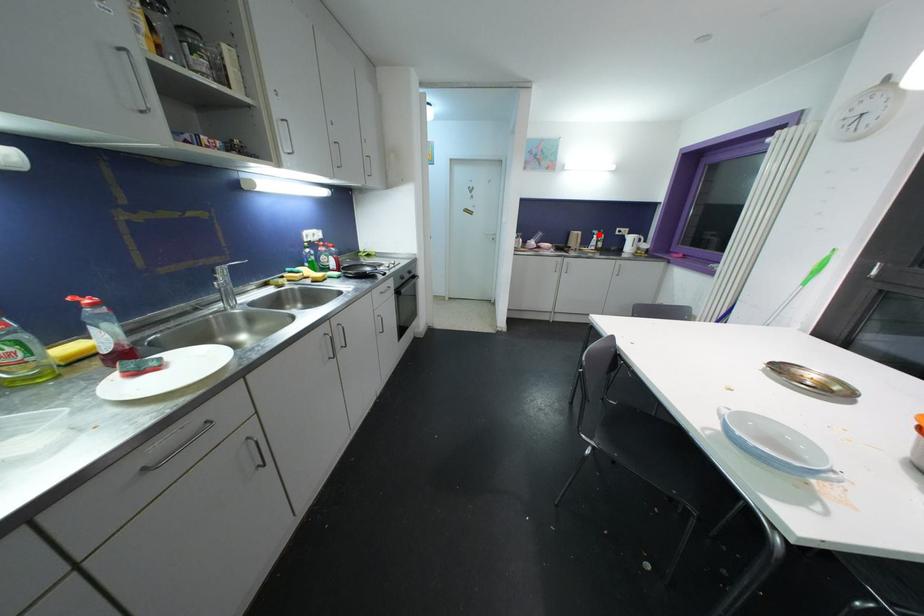
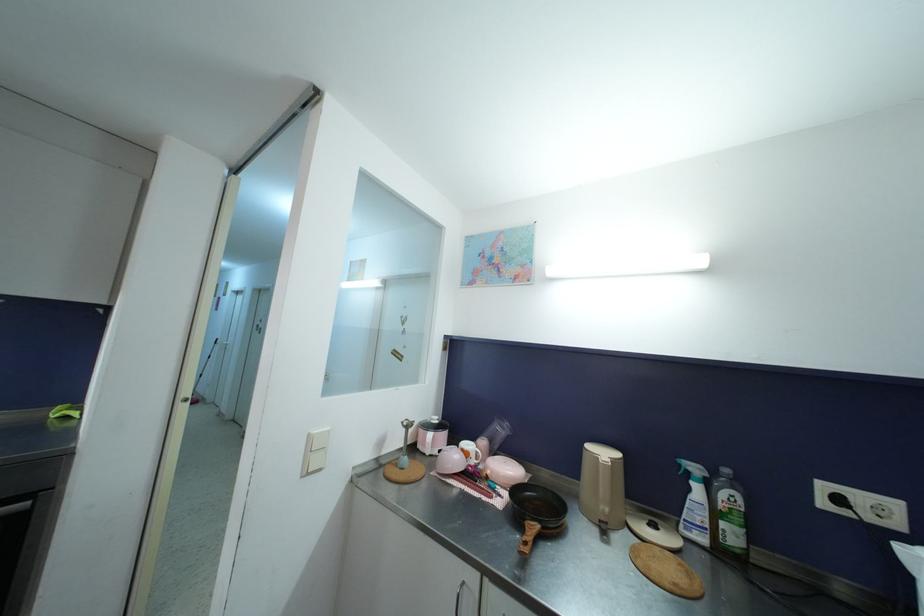
The point at the highlighted location is marked in the first image. Where is the corresponding point in the second image?

(699, 472)